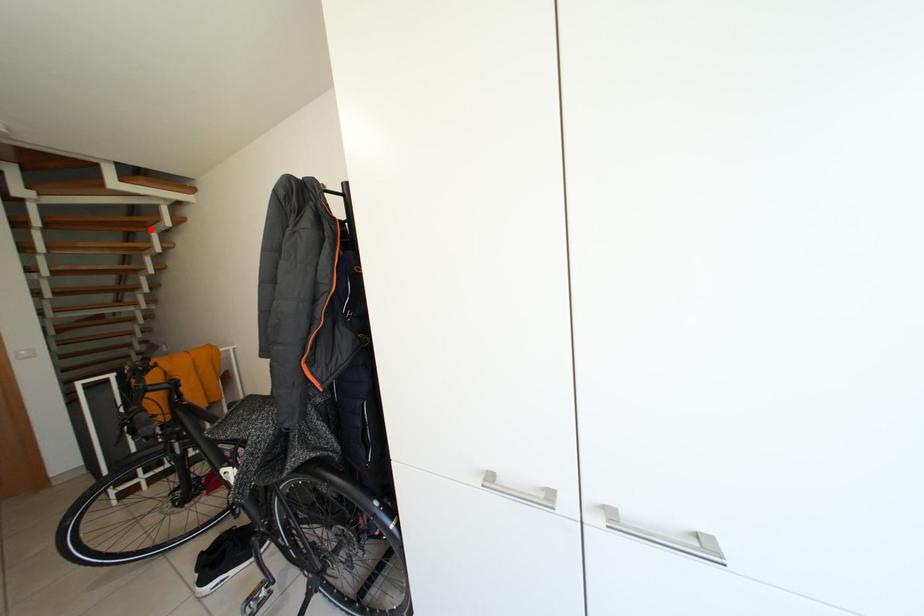
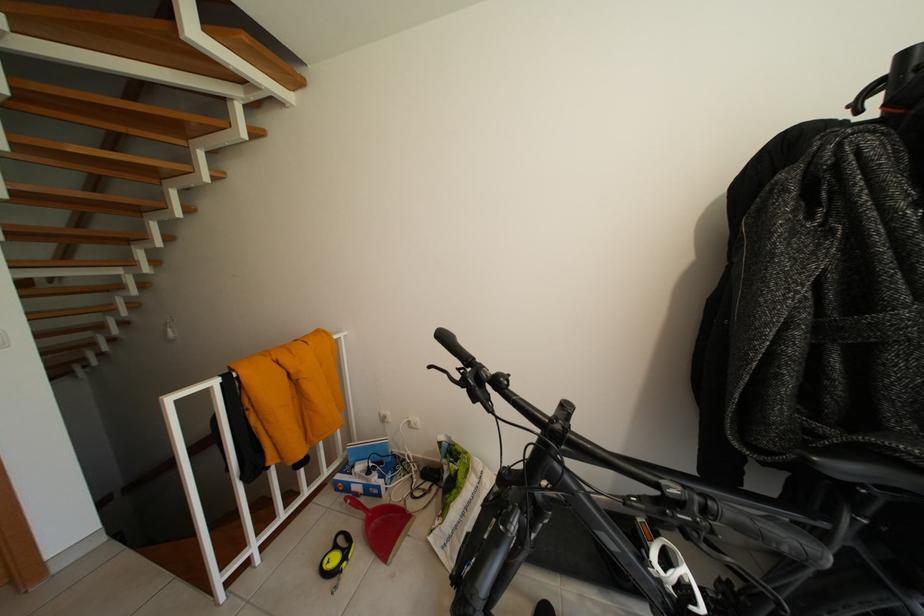
Locate, in the second image, the point that corresponds to the highlighted location in the first image.

(190, 137)